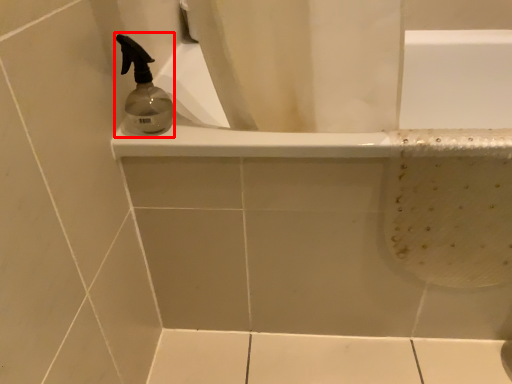
Question: From the image's perspective, where is soap dispenser (annotated by the red box) located in relation to bathtub in the image?

Choices:
 (A) below
 (B) above

Answer: (B)